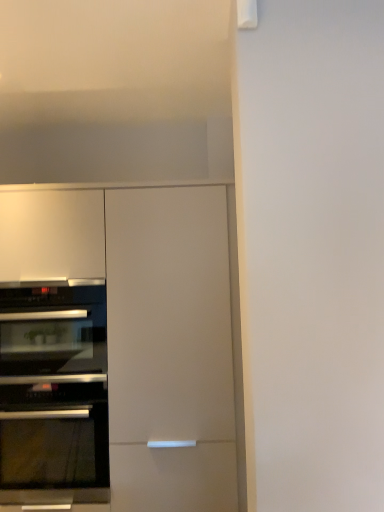
Question: Does black glass oven at left, the first oven from the top, have a greater width compared to matte white cabinet at left?

Choices:
 (A) yes
 (B) no

Answer: (B)

Question: From the image's perspective, is black glass oven at left, the first oven from the top, over matte white cabinet at left?

Choices:
 (A) yes
 (B) no

Answer: (A)

Question: Considering the relative sizes of black glass oven at left, positioned as the second oven in bottom-to-top order, and matte white cabinet at left in the image provided, is black glass oven at left, positioned as the second oven in bottom-to-top order, bigger than matte white cabinet at left?

Choices:
 (A) yes
 (B) no

Answer: (B)

Question: From the image's perspective, is black glass oven at left, the first oven from the top, under matte white cabinet at left?

Choices:
 (A) no
 (B) yes

Answer: (A)

Question: Does black glass oven at left, positioned as the second oven in bottom-to-top order, appear on the right side of matte white cabinet at left?

Choices:
 (A) yes
 (B) no

Answer: (B)

Question: Is black glass oven at left, the first oven from the top, in front of matte white cabinet at left?

Choices:
 (A) no
 (B) yes

Answer: (A)

Question: Considering the relative sizes of black glass oven at left, the first oven from the top, and black glass oven at left, placed as the first oven when sorted from bottom to top, in the image provided, is black glass oven at left, the first oven from the top, wider than black glass oven at left, placed as the first oven when sorted from bottom to top,?

Choices:
 (A) no
 (B) yes

Answer: (A)

Question: Is black glass oven at left, the first oven from the top, bigger than black glass oven at left, which appears as the second oven when viewed from the top?

Choices:
 (A) no
 (B) yes

Answer: (A)

Question: Is black glass oven at left, positioned as the second oven in bottom-to-top order, oriented towards black glass oven at left, which appears as the second oven when viewed from the top?

Choices:
 (A) no
 (B) yes

Answer: (A)

Question: Considering the relative sizes of black glass oven at left, the first oven from the top, and black glass oven at left, placed as the first oven when sorted from bottom to top, in the image provided, is black glass oven at left, the first oven from the top, taller than black glass oven at left, placed as the first oven when sorted from bottom to top,?

Choices:
 (A) no
 (B) yes

Answer: (A)

Question: Does black glass oven at left, positioned as the second oven in bottom-to-top order, appear on the right side of black glass oven at left, which appears as the second oven when viewed from the top?

Choices:
 (A) no
 (B) yes

Answer: (A)

Question: Can you confirm if black glass oven at left, the first oven from the top, is smaller than black glass oven at left, placed as the first oven when sorted from bottom to top?

Choices:
 (A) no
 (B) yes

Answer: (B)

Question: Is black glass oven at left, placed as the first oven when sorted from bottom to top, closer to camera compared to black glass oven at left, positioned as the second oven in bottom-to-top order?

Choices:
 (A) no
 (B) yes

Answer: (B)